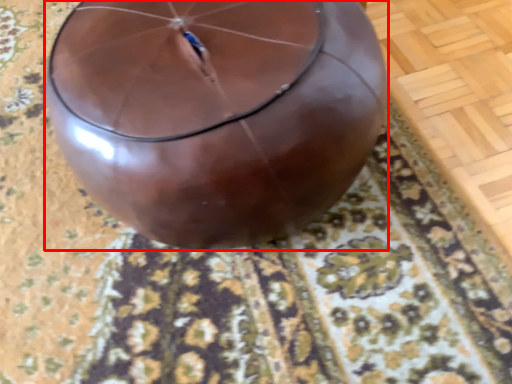
Question: From the image's perspective, what is the correct spatial positioning of balloon (annotated by the red box) in reference to mat?

Choices:
 (A) below
 (B) above

Answer: (A)